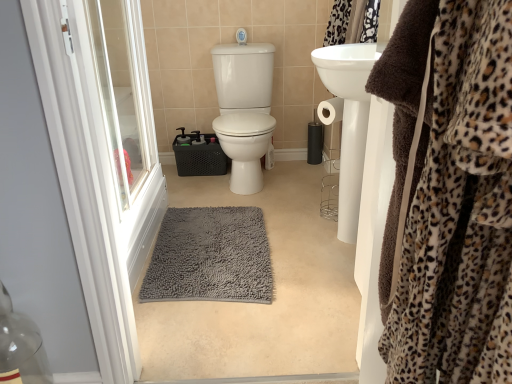
Measure the distance between gray shaggy rug at center and camera.

1.29 meters.

At what (x,y) coordinates should I click in order to perform the action: click on brown plush robe at right. Please return your answer as a coordinate pair (x, y). Looking at the image, I should click on (460, 212).

Identify the location of gray shaggy bath mat at center. The width and height of the screenshot is (512, 384). (210, 257).

This screenshot has height=384, width=512. Find the location of `gray shaggy rug at center`. gray shaggy rug at center is located at coordinates (261, 304).

From the image's perspective, is brown plush robe at right on top of gray shaggy rug at center?

Yes, from the image's perspective, brown plush robe at right is over gray shaggy rug at center.

Considering the sizes of brown plush robe at right and gray shaggy rug at center in the image, is brown plush robe at right bigger or smaller than gray shaggy rug at center?

Considering their sizes, brown plush robe at right takes up less space than gray shaggy rug at center.

How many degrees apart are the facing directions of brown plush robe at right and gray shaggy rug at center?

61.8 degrees separate the facing orientations of brown plush robe at right and gray shaggy rug at center.

Is brown plush robe at right not near gray shaggy rug at center?

No, brown plush robe at right is not far from gray shaggy rug at center.

From the image's perspective, would you say white plastic screen door at left is shown under gray shaggy rug at center?

Actually, white plastic screen door at left appears above gray shaggy rug at center in the image.

In the scene shown: Who is more distant, white plastic screen door at left or gray shaggy rug at center?

gray shaggy rug at center is more distant.

Is white plastic screen door at left not inside gray shaggy rug at center?

Yes, white plastic screen door at left is outside of gray shaggy rug at center.

Are white plastic screen door at left and gray shaggy rug at center located far from each other?

No, white plastic screen door at left is in close proximity to gray shaggy rug at center.

Does point (280, 181) appear closer or farther from the camera than point (55, 160)?

Point (280, 181) appears to be farther away from the viewer than point (55, 160).

Looking at their sizes, would you say gray shaggy rug at center is wider or thinner than white plastic screen door at left?

Clearly, gray shaggy rug at center has more width compared to white plastic screen door at left.

From the image's perspective, which one is positioned lower, gray shaggy rug at center or white plastic screen door at left?

From the image's view, gray shaggy rug at center is below.

The image size is (512, 384). Identify the location of plain on the right side of gray shaggy bath mat at center. (261, 304).

Considering the points (226, 232) and (327, 346), which point is behind, point (226, 232) or point (327, 346)?

Point (226, 232)

Does gray shaggy bath mat at center turn towards gray shaggy rug at center?

No, gray shaggy bath mat at center is not facing towards gray shaggy rug at center.

From a real-world perspective, is gray shaggy bath mat at center physically above gray shaggy rug at center?

Indeed, from a real-world perspective, gray shaggy bath mat at center stands above gray shaggy rug at center.

Considering the relative positions of gray shaggy rug at center and gray shaggy bath mat at center in the image provided, is gray shaggy rug at center to the left or to the right of gray shaggy bath mat at center?

gray shaggy rug at center is positioned on gray shaggy bath mat at center's right side.

From the picture: Is gray shaggy rug at center smaller than gray shaggy bath mat at center?

No.

Is gray shaggy rug at center oriented away from gray shaggy bath mat at center?

Yes, gray shaggy rug at center is positioned with its back facing gray shaggy bath mat at center.

From a real-world perspective, is gray shaggy rug at center physically above gray shaggy bath mat at center?

No, from a real-world perspective, gray shaggy rug at center is not above gray shaggy bath mat at center.

How different are the orientations of brown plush robe at right and gray shaggy bath mat at center in degrees?

The angle between the facing direction of brown plush robe at right and the facing direction of gray shaggy bath mat at center is 152 degrees.

Is brown plush robe at right aimed at gray shaggy bath mat at center?

No.

Can you confirm if brown plush robe at right is bigger than gray shaggy bath mat at center?

Actually, brown plush robe at right might be smaller than gray shaggy bath mat at center.

Based on the photo, from the image's perspective, which is below, brown plush robe at right or gray shaggy bath mat at center?

gray shaggy bath mat at center, from the image's perspective.

Is white plastic screen door at left oriented towards brown plush robe at right?

Yes, white plastic screen door at left faces towards brown plush robe at right.

Which of these two, white plastic screen door at left or brown plush robe at right, is wider?

white plastic screen door at left.

In terms of size, does white plastic screen door at left appear bigger or smaller than brown plush robe at right?

Considering their sizes, white plastic screen door at left takes up more space than brown plush robe at right.

Between white plastic screen door at left and brown plush robe at right, which one appears on the left side from the viewer's perspective?

white plastic screen door at left is more to the left.

Find the location of a particular element. plain that appears on the left of brown plush robe at right is located at coordinates (261, 304).

Find the location of a particular element. This screenshot has width=512, height=384. screen door above the gray shaggy rug at center (from a real-world perspective) is located at coordinates (84, 179).

From the image, which object appears to be nearer to white plastic screen door at left, gray shaggy rug at center or gray shaggy bath mat at center?

gray shaggy rug at center is positioned closer to the anchor white plastic screen door at left.

Estimate the real-world distances between objects in this image. Which object is further from brown plush robe at right, gray shaggy rug at center or gray shaggy bath mat at center?

Based on the image, gray shaggy bath mat at center appears to be further to brown plush robe at right.

Considering their positions, is gray shaggy rug at center positioned closer to brown plush robe at right than white plastic screen door at left?

Among the two, white plastic screen door at left is located nearer to brown plush robe at right.

Looking at the image, which one is located further to gray shaggy bath mat at center, gray shaggy rug at center or white plastic screen door at left?

Among the two, white plastic screen door at left is located further to gray shaggy bath mat at center.

From the image, which object appears to be farther from gray shaggy rug at center, gray shaggy bath mat at center or brown plush robe at right?

brown plush robe at right is positioned further to the anchor gray shaggy rug at center.

Looking at the image, which one is located closer to gray shaggy bath mat at center, white plastic screen door at left or gray shaggy rug at center?

gray shaggy rug at center lies closer to gray shaggy bath mat at center than the other object.

When comparing their distances from gray shaggy bath mat at center, does brown plush robe at right or gray shaggy rug at center seem closer?

The object closer to gray shaggy bath mat at center is gray shaggy rug at center.

Looking at the image, which one is located closer to gray shaggy bath mat at center, brown plush robe at right or white plastic screen door at left?

Based on the image, white plastic screen door at left appears to be nearer to gray shaggy bath mat at center.

Locate an element on the screen. screen door located between brown plush robe at right and gray shaggy bath mat at center in the depth direction is located at coordinates tap(84, 179).

This screenshot has width=512, height=384. Identify the location of plain between brown plush robe at right and gray shaggy bath mat at center along the z-axis. (261, 304).

Where is `plain between white plastic screen door at left and brown plush robe at right in the horizontal direction`? The height and width of the screenshot is (384, 512). plain between white plastic screen door at left and brown plush robe at right in the horizontal direction is located at coordinates (261, 304).

At what (x,y) coordinates should I click in order to perform the action: click on plain between white plastic screen door at left and gray shaggy bath mat at center in the front-back direction. Please return your answer as a coordinate pair (x, y). This screenshot has height=384, width=512. Looking at the image, I should click on (261, 304).